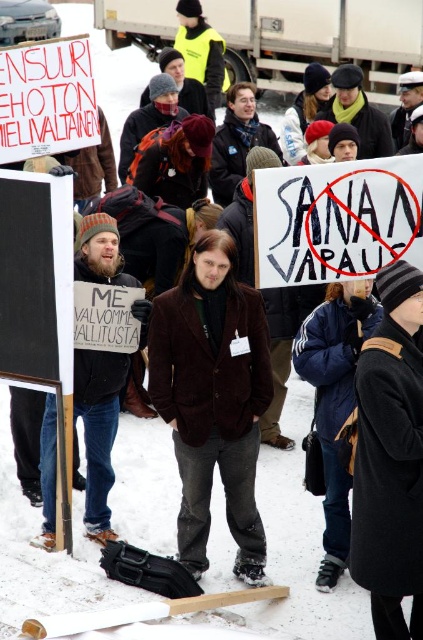
Is black woolen hat at upper right to the right of black paper sign at center from the viewer's perspective?

Correct, you'll find black woolen hat at upper right to the right of black paper sign at center.

Does black woolen hat at upper right have a smaller size compared to black paper sign at center?

No.

Between point (387, 472) and point (414, 179), which one is positioned behind?

Positioned behind is point (414, 179).

I want to click on black woolen hat at upper right, so click(x=390, y=458).

Is velvet brown blazer at center positioned behind red cardboard sign at upper left?

That is False.

From the picture: Between velvet brown blazer at center and red cardboard sign at upper left, which one appears on the right side from the viewer's perspective?

Positioned to the right is velvet brown blazer at center.

Measure the distance between point (217, 392) and camera.

Point (217, 392) and camera are 30.05 feet apart from each other.

This screenshot has height=640, width=423. I want to click on velvet brown blazer at center, so click(x=213, y=397).

Does point (88, 429) lie in front of point (65, 125)?

Yes, point (88, 429) is in front of point (65, 125).

Consider the image. Measure the distance from bearded man with sign at center to red cardboard sign at upper left.

bearded man with sign at center is 5.69 feet from red cardboard sign at upper left.

Does point (51, 512) lie in front of point (62, 99)?

Yes, it is in front of point (62, 99).

Locate an element on the screen. The image size is (423, 640). bearded man with sign at center is located at coordinates (98, 429).